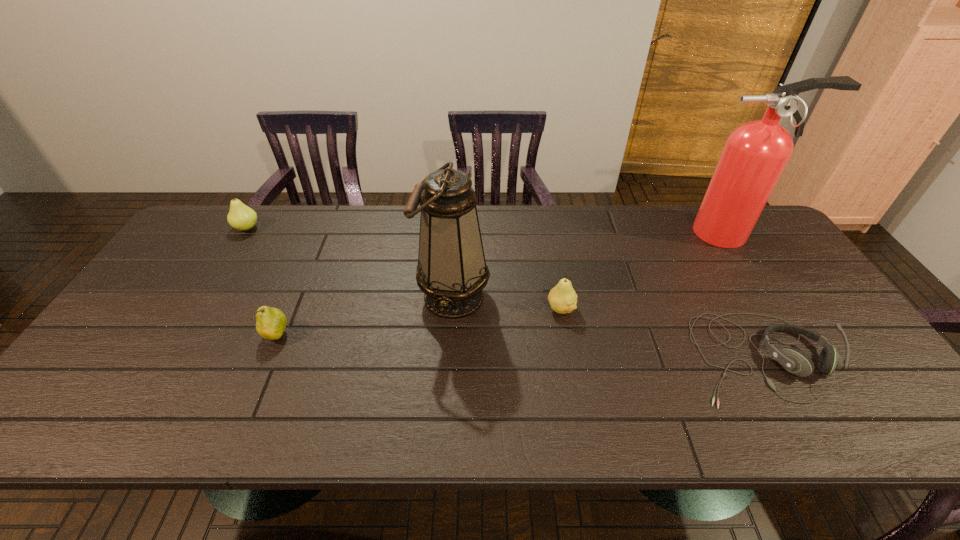
At what (x,y) coordinates should I click in order to perform the action: click on the closest pear to the headset. Please return your answer as a coordinate pair (x, y). Looking at the image, I should click on (562, 298).

Locate which pear is the second closest to the oil lamp. Please provide its 2D coordinates. Your answer should be formatted as a tuple, i.e. [(x, y)], where the tuple contains the x and y coordinates of a point satisfying the conditions above.

[(270, 322)]